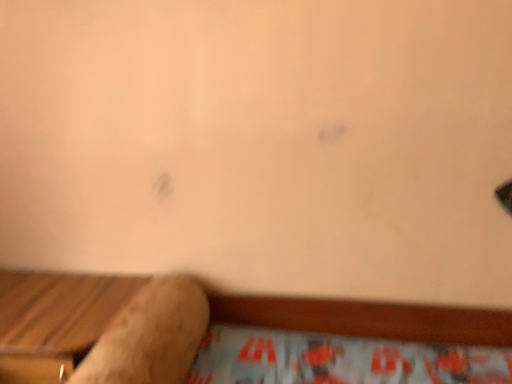
The width and height of the screenshot is (512, 384). Describe the element at coordinates (150, 336) in the screenshot. I see `wooden log at lower left` at that location.

Find the location of `wooden log at lower left`. wooden log at lower left is located at coordinates (150, 336).

Find the location of a particular element. The width and height of the screenshot is (512, 384). wooden log at lower left is located at coordinates (150, 336).